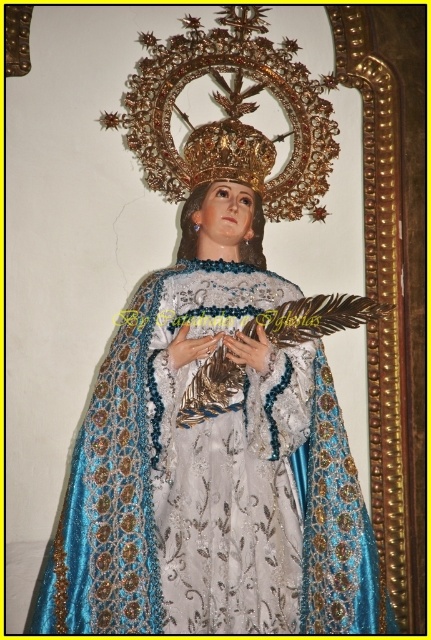
Does point (265, 193) come closer to viewer compared to point (253, 216)?

No, (265, 193) is further to viewer.

The image size is (431, 640). What do you see at coordinates (230, 115) in the screenshot?
I see `gold/gilded metal/crown at upper center` at bounding box center [230, 115].

Which is behind, point (169, 182) or point (262, 228)?

The point (169, 182) is more distant.

Find the location of a particular element. gold/gilded metal/crown at upper center is located at coordinates (230, 115).

Which is more to the right, silky blue fabric dress at center or gold/gilded metal/crown at upper center?

From the viewer's perspective, gold/gilded metal/crown at upper center appears more on the right side.

This screenshot has width=431, height=640. What do you see at coordinates (212, 480) in the screenshot? I see `silky blue fabric dress at center` at bounding box center [212, 480].

At what (x,y) coordinates should I click in order to perform the action: click on silky blue fabric dress at center. Please return your answer as a coordinate pair (x, y). The width and height of the screenshot is (431, 640). Looking at the image, I should click on (212, 480).

Does silky blue fabric dress at center have a greater width compared to matte gold head at center?

Indeed, silky blue fabric dress at center has a greater width compared to matte gold head at center.

Can you confirm if silky blue fabric dress at center is smaller than matte gold head at center?

No.

Locate an element on the screen. silky blue fabric dress at center is located at coordinates (212, 480).